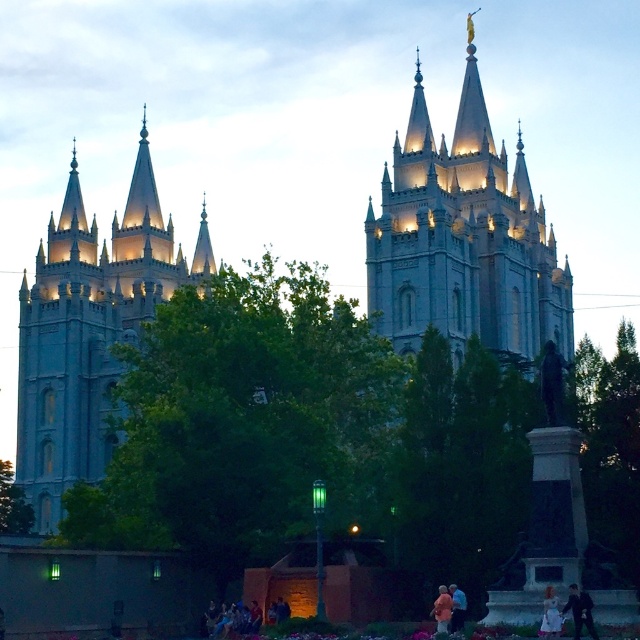
Is light brown hair at lower right bigger than light blue fabric at lower center?

Yes.

Who is taller, light brown hair at lower right or light blue fabric at lower center?

With more height is light blue fabric at lower center.

Is point (554, 593) positioned behind point (456, 600)?

No, (554, 593) is in front of (456, 600).

Where is `light brown hair at lower right`? The image size is (640, 640). light brown hair at lower right is located at coordinates (550, 612).

Does light gray stone tower at left have a lesser width compared to dark blue suit at lower right?

No, light gray stone tower at left is not thinner than dark blue suit at lower right.

Can you confirm if light gray stone tower at left is taller than dark blue suit at lower right?

Yes, light gray stone tower at left is taller than dark blue suit at lower right.

Does point (132, 269) come farther from viewer compared to point (577, 618)?

Yes, point (132, 269) is farther from viewer.

The image size is (640, 640). I want to click on light gray stone tower at left, so click(88, 330).

Is light gray stone tower at left above light brown hair at lower right?

Correct, light gray stone tower at left is located above light brown hair at lower right.

Who is lower down, light gray stone tower at left or light brown hair at lower right?

light brown hair at lower right is lower down.

This screenshot has height=640, width=640. What are the coordinates of `light gray stone tower at left` in the screenshot? It's located at (88, 330).